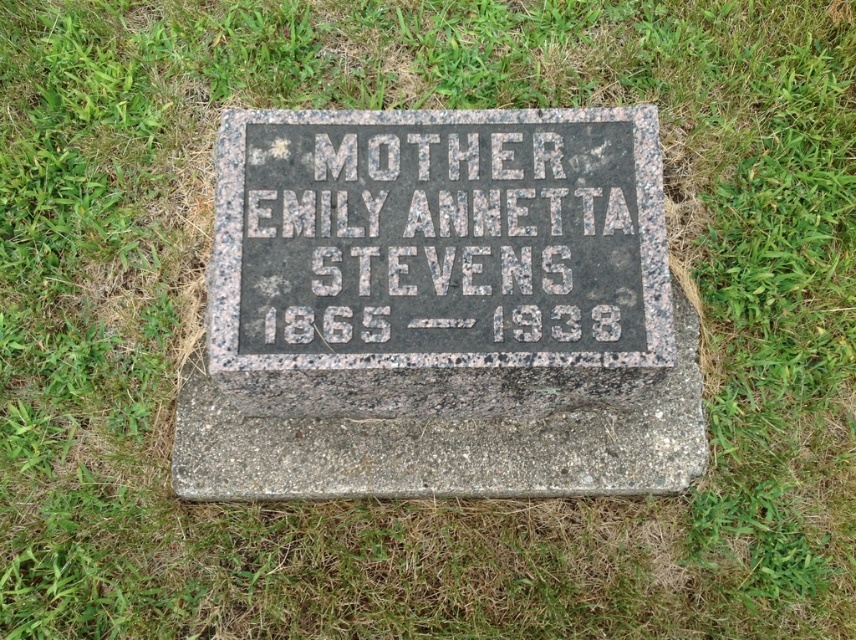
You are standing at the origin point of the coordinate system. You want to place a flower at the exact center of the granite gravestone at center. According to the coordinates, where should you place the flower?

The granite gravestone at center is located at point (440,308), so you should place the flower at those coordinates to be at its exact center.

You are standing in a cemetery and see the granite gravestone at center and the granite at center. Which one is positioned to the right of the other?

The granite gravestone at center is to the right of the granite at center.